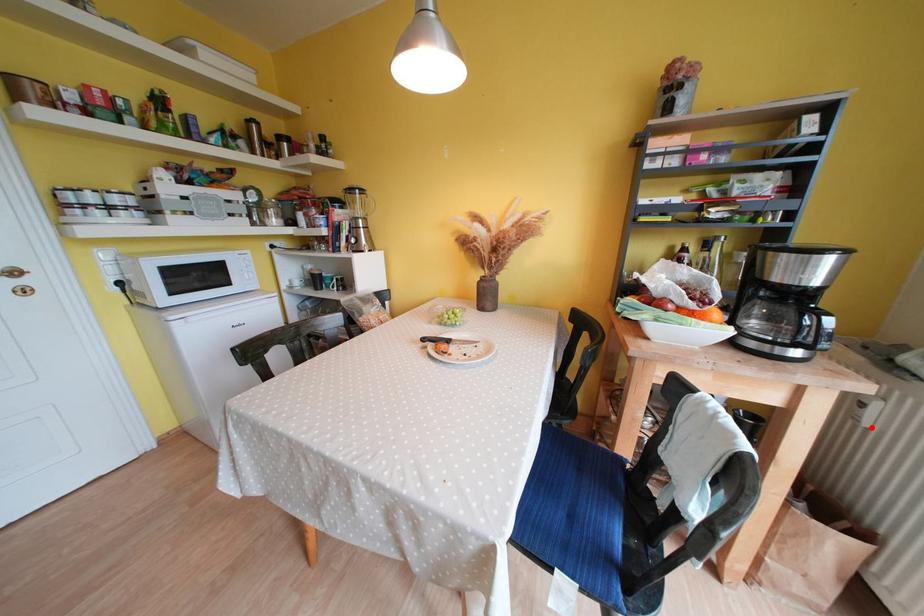
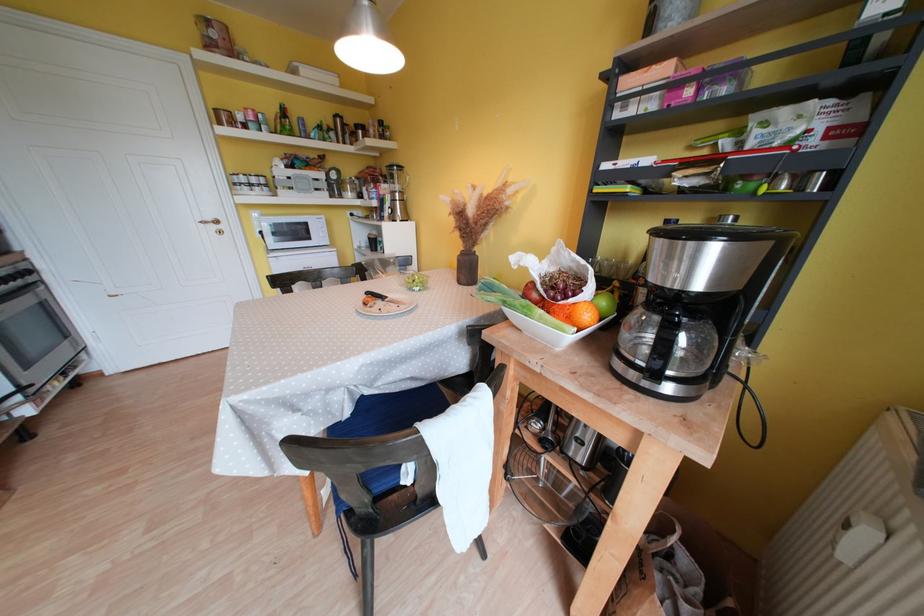
The point at the highlighted location is marked in the first image. Where is the corresponding point in the second image?

(850, 562)